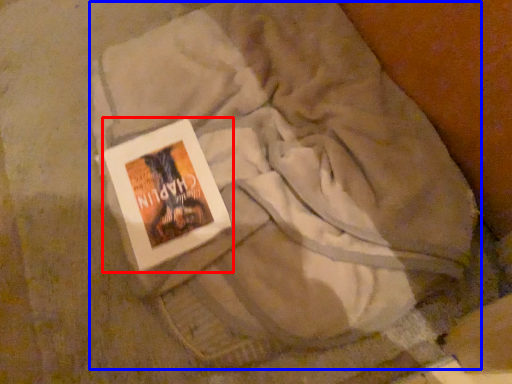
Question: Among these objects, which one is farthest to the camera, book (highlighted by a red box) or textile (highlighted by a blue box)?

Choices:
 (A) book
 (B) textile

Answer: (A)